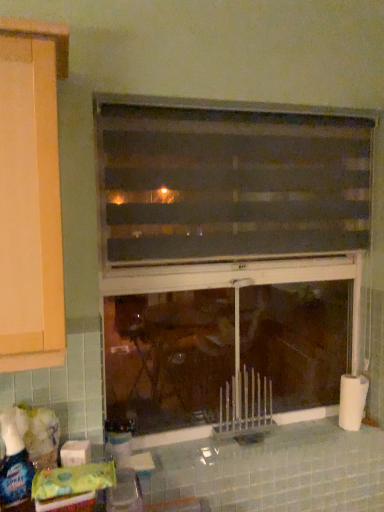
Question: Considering their positions, is white matte toilet paper at lower left, positioned as the 1th toilet paper in front-to-back order, located in front of or behind translucent plastic spray bottle at lower left, the first bottle in the front-to-back sequence?

Choices:
 (A) behind
 (B) front

Answer: (A)

Question: Considering the relative positions of white matte toilet paper at lower left, positioned as the second toilet paper in back-to-front order, and translucent plastic spray bottle at lower left, which is counted as the second bottle, starting from the back, in the image provided, is white matte toilet paper at lower left, positioned as the second toilet paper in back-to-front order, to the left or to the right of translucent plastic spray bottle at lower left, which is counted as the second bottle, starting from the back,?

Choices:
 (A) right
 (B) left

Answer: (A)

Question: Which object is positioned farthest from the translucent plastic spray bottle at lower left, which is the first bottle in left-to-right order?

Choices:
 (A) white matte toilet paper at lower left, positioned as the second toilet paper in back-to-front order
 (B) white matte toilet paper at right, which ranks as the 1th toilet paper in right-to-left order
 (C) translucent plastic bottle at lower left, arranged as the second bottle when viewed from the left
 (D) translucent plastic window at center, acting as the second window starting from the bottom
 (E) black matte window at center, the second window positioned from the top

Answer: (B)

Question: Estimate the real-world distances between objects in this image. Which object is closer to the translucent plastic window at center, which is counted as the first window, starting from the top?

Choices:
 (A) white matte toilet paper at lower left, which ranks as the 2th toilet paper in right-to-left order
 (B) white matte toilet paper at right, which is counted as the 2th toilet paper, starting from the front
 (C) translucent plastic spray bottle at lower left, which is the first bottle in left-to-right order
 (D) black matte window at center, the second window positioned from the top
 (E) translucent plastic bottle at lower left, the first bottle viewed from the back

Answer: (D)